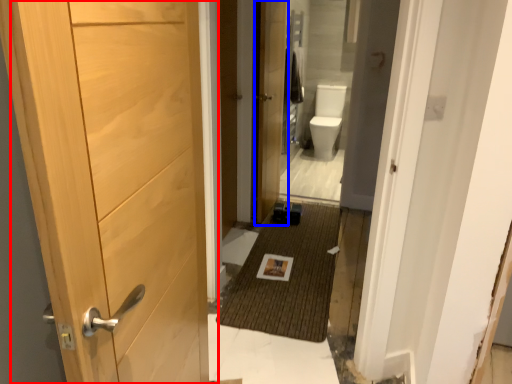
Question: Among these objects, which one is farthest to the camera, door (highlighted by a red box) or door (highlighted by a blue box)?

Choices:
 (A) door
 (B) door

Answer: (B)